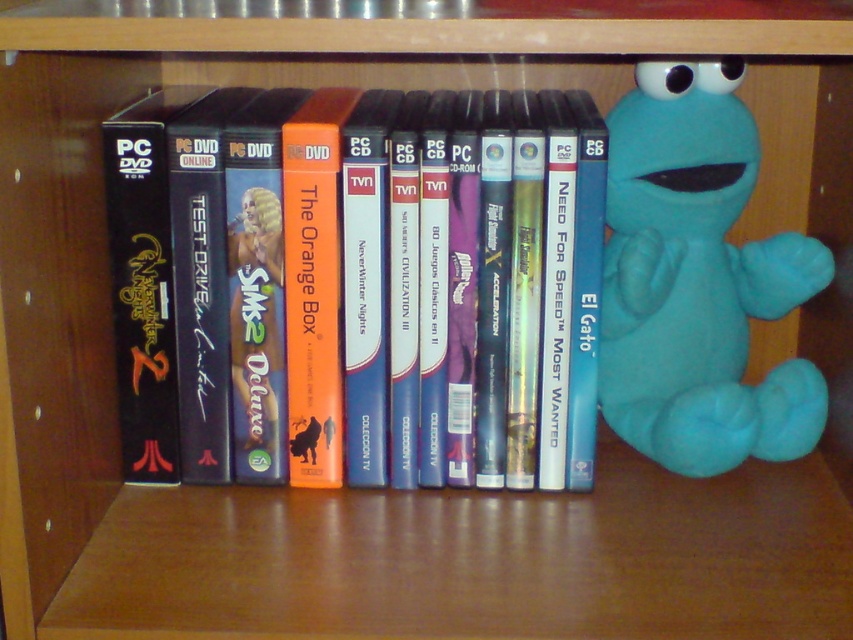
Question: Which point is farther to the camera?

Choices:
 (A) orange matte dvd case at center
 (B) teal plush toy at right

Answer: (B)

Question: Is orange matte dvd case at center positioned in front of teal plush toy at right?

Choices:
 (A) no
 (B) yes

Answer: (B)

Question: Which object appears closest to the camera in this image?

Choices:
 (A) teal plush toy at right
 (B) orange matte dvd case at center

Answer: (B)

Question: Does orange matte dvd case at center appear over teal plush toy at right?

Choices:
 (A) yes
 (B) no

Answer: (B)

Question: Can you confirm if orange matte dvd case at center is smaller than teal plush toy at right?

Choices:
 (A) yes
 (B) no

Answer: (B)